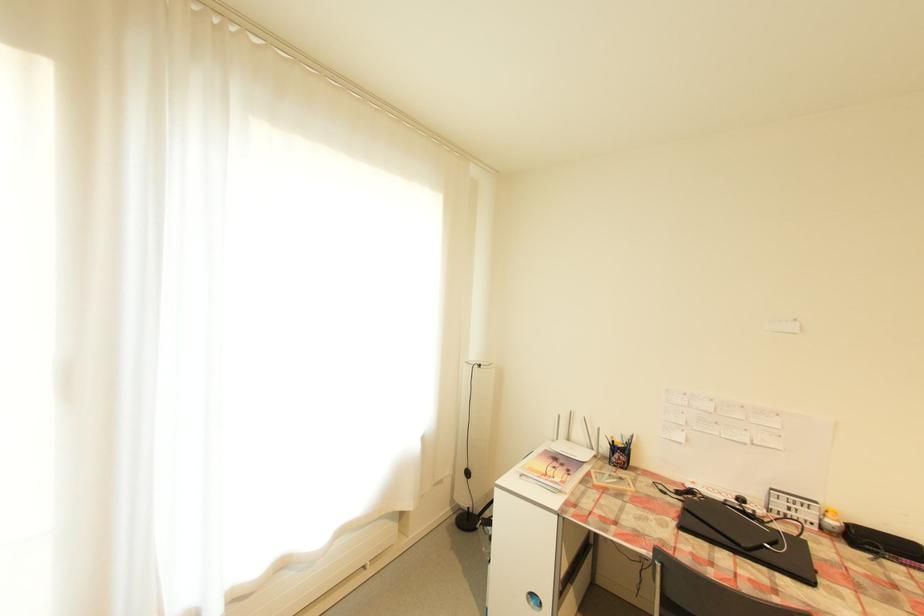
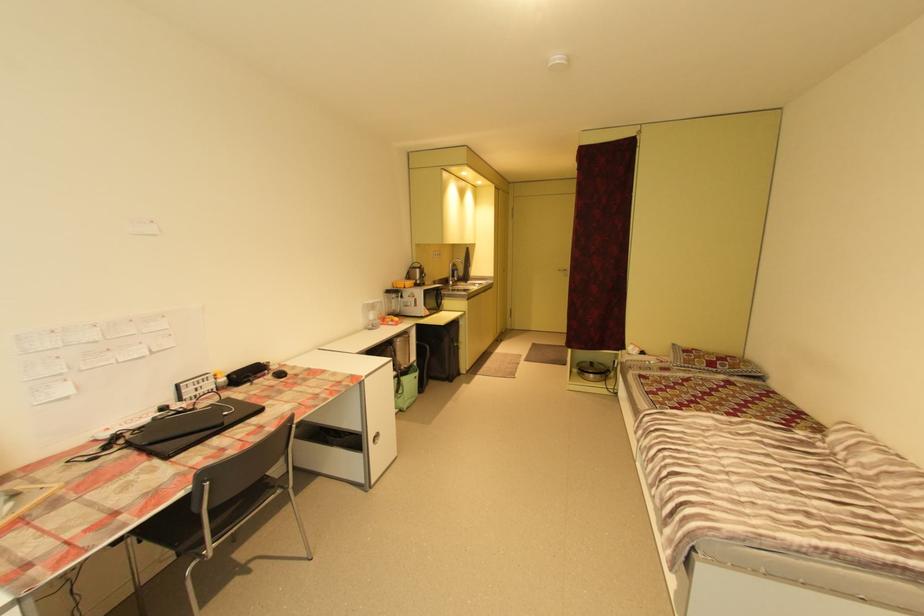
The point at (773, 546) is marked in the first image. Where is the corresponding point in the second image?

(232, 414)